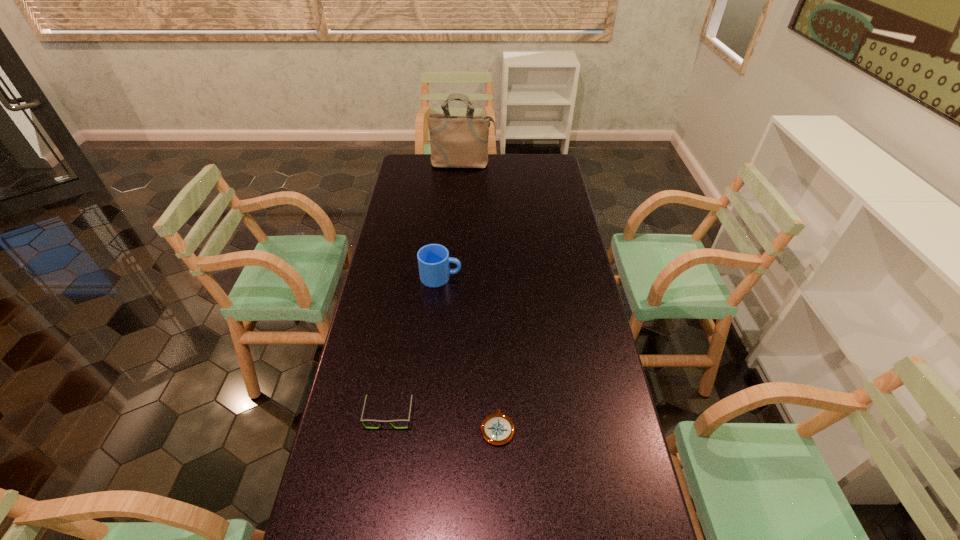
At what (x,y) coordinates should I click in order to perform the action: click on vacant space that satisfies the following two spatial constraints: 1. on the front-facing side of the farthest object; 2. on the side of the second farthest object with the handle. Please return your answer as a coordinate pair (x, y). The height and width of the screenshot is (540, 960). Looking at the image, I should click on (x=457, y=277).

This screenshot has height=540, width=960. Find the location of `free spot that satisfies the following two spatial constraints: 1. on the front-facing side of the tallest object; 2. on the side of the mug with the handle`. free spot that satisfies the following two spatial constraints: 1. on the front-facing side of the tallest object; 2. on the side of the mug with the handle is located at coordinates (457, 277).

You are a GUI agent. You are given a task and a screenshot of the screen. Output one action in this format:
    pyautogui.click(x=<x>, y=<y>)
    Task: Click on the vacant region that satisfies the following two spatial constraints: 1. on the side of the mug with the handle; 2. on the lens of the second shortest object
    This screenshot has height=540, width=960.
    Given the screenshot: What is the action you would take?
    pyautogui.click(x=428, y=415)

Locate an element on the screen. The width and height of the screenshot is (960, 540). vacant space that satisfies the following two spatial constraints: 1. on the front-facing side of the shoulder bag; 2. on the left side of the shortest object is located at coordinates (448, 428).

The image size is (960, 540). Identify the location of vacant area that satisfies the following two spatial constraints: 1. on the front-facing side of the compass; 2. on the right side of the shoulder bag. (448, 428).

Where is `vacant space that satisfies the following two spatial constraints: 1. on the side of the mug with the handle; 2. on the lens of the spectacles`? This screenshot has width=960, height=540. vacant space that satisfies the following two spatial constraints: 1. on the side of the mug with the handle; 2. on the lens of the spectacles is located at coordinates (428, 415).

At what (x,y) coordinates should I click in order to perform the action: click on free space that satisfies the following two spatial constraints: 1. on the front-facing side of the farthest object; 2. on the side of the mug with the handle. Please return your answer as a coordinate pair (x, y). Image resolution: width=960 pixels, height=540 pixels. Looking at the image, I should click on (457, 277).